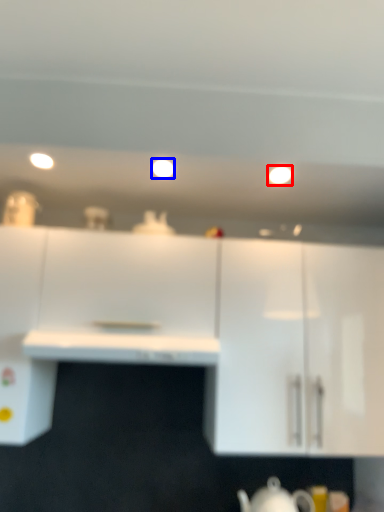
Question: Which object is closer to the camera taking this photo, lighting (highlighted by a red box) or lighting (highlighted by a blue box)?

Choices:
 (A) lighting
 (B) lighting

Answer: (B)